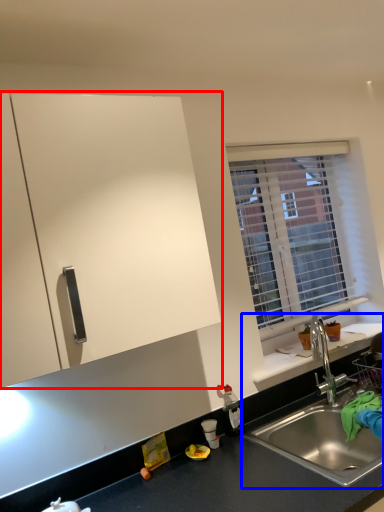
Question: Among these objects, which one is nearest to the camera, cabinetry (highlighted by a red box) or sink (highlighted by a blue box)?

Choices:
 (A) cabinetry
 (B) sink

Answer: (A)